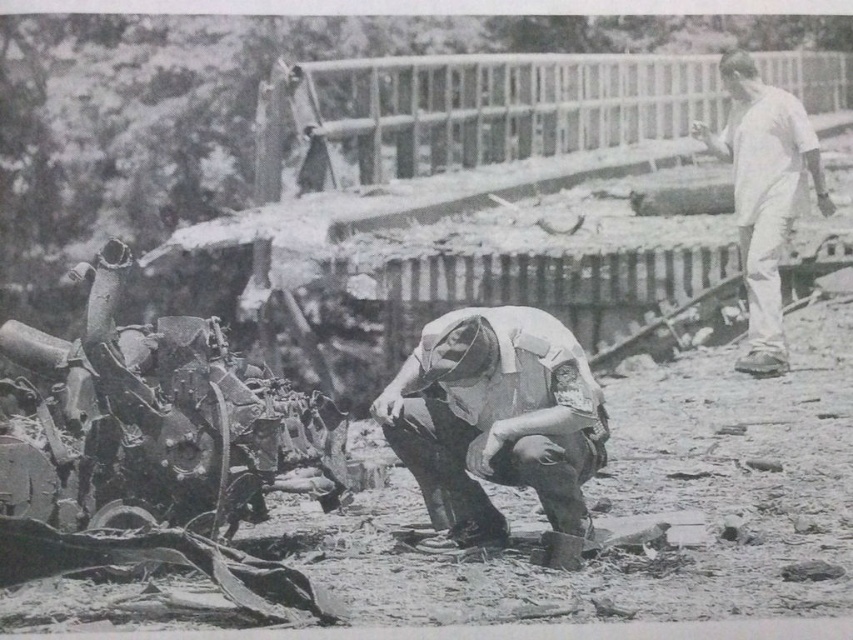
Measure the distance between rusty metal tank at lower left and camera.

They are 15.30 feet apart.

Is rusty metal tank at lower left above white cotton shirt at upper right?

No.

Which is behind, point (91, 435) or point (781, 314)?

Positioned behind is point (781, 314).

The height and width of the screenshot is (640, 853). I want to click on rusty metal tank at lower left, so click(x=160, y=420).

Is point (184, 492) farther from camera compared to point (502, 372)?

Yes, point (184, 492) is farther from viewer.

Can you confirm if rusty metal tank at lower left is bigger than white fabric uniform at center?

Correct, rusty metal tank at lower left is larger in size than white fabric uniform at center.

Is point (57, 337) positioned after point (589, 472)?

Yes, point (57, 337) is behind point (589, 472).

The image size is (853, 640). In order to click on rusty metal tank at lower left in this screenshot , I will do `click(160, 420)`.

Does white fabric uniform at center appear on the left side of white cotton shirt at upper right?

Yes, white fabric uniform at center is to the left of white cotton shirt at upper right.

Does white fabric uniform at center have a lesser height compared to white cotton shirt at upper right?

Correct, white fabric uniform at center is not as tall as white cotton shirt at upper right.

Who is more forward, [592,420] or [743,152]?

Point [592,420] is more forward.

Locate an element on the screen. The height and width of the screenshot is (640, 853). white fabric uniform at center is located at coordinates (496, 419).